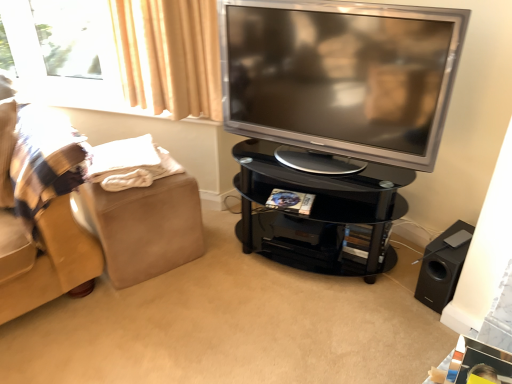
Question: From the image's perspective, is black matte speaker at lower right located above or below silver metallic television at upper right?

Choices:
 (A) above
 (B) below

Answer: (B)

Question: Considering the relative positions of black matte speaker at lower right and silver metallic television at upper right in the image provided, is black matte speaker at lower right to the left or to the right of silver metallic television at upper right?

Choices:
 (A) right
 (B) left

Answer: (A)

Question: Considering the real-world distances, which object is closest to the silver metallic television at upper right?

Choices:
 (A) black glass tv stand at center
 (B) black glossy tv stand at center
 (C) beige fabric footrest at left
 (D) black matte speaker at lower right

Answer: (A)

Question: Which object is the closest to the black glossy tv stand at center?

Choices:
 (A) silver metallic television at upper right
 (B) beige fabric footrest at left
 (C) black matte speaker at lower right
 (D) black glass tv stand at center

Answer: (B)